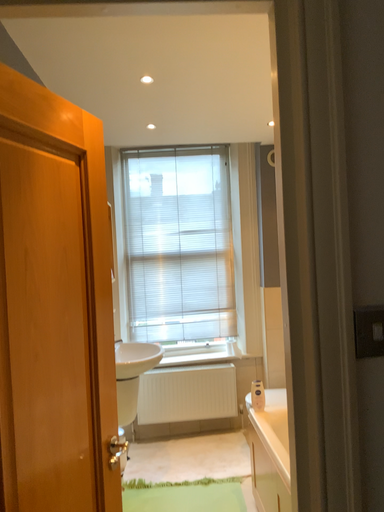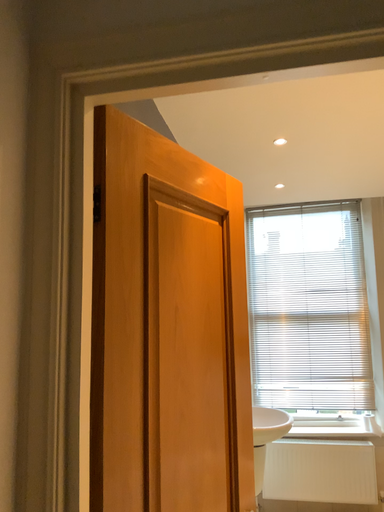
Question: Which way did the camera rotate in the video?

Choices:
 (A) rotated left
 (B) rotated right

Answer: (A)